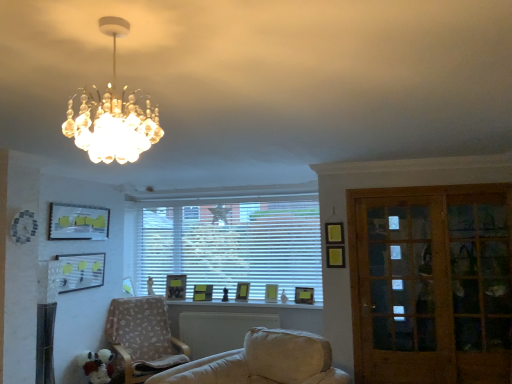
Question: Should I look upward or downward to see matte yellow picture frame at upper left, the first picture frame positioned from the left?

Choices:
 (A) down
 (B) up

Answer: (A)

Question: Can you confirm if matte black picture frame at window, which is the third picture frame in right-to-left order, is bigger than white glossy window sill at center?

Choices:
 (A) yes
 (B) no

Answer: (B)

Question: From the image's perspective, is matte black picture frame at window, the 5th picture frame from the left, located above white glossy window sill at center?

Choices:
 (A) no
 (B) yes

Answer: (B)

Question: Is matte black picture frame at window, which is the third picture frame in right-to-left order, at the left side of white glossy window sill at center?

Choices:
 (A) no
 (B) yes

Answer: (A)

Question: Is matte black picture frame at window, the 5th picture frame from the left, aimed at white glossy window sill at center?

Choices:
 (A) no
 (B) yes

Answer: (A)

Question: Is white glossy window sill at center a part of matte black picture frame at window, which is the third picture frame in right-to-left order?

Choices:
 (A) yes
 (B) no

Answer: (B)

Question: Is matte yellow picture frame at left, placed as the second picture frame when sorted from left to right, to the right of matte black picture frame at center, which is the 3th picture frame from left to right, from the viewer's perspective?

Choices:
 (A) yes
 (B) no

Answer: (B)

Question: Can you confirm if matte yellow picture frame at left, placed as the second picture frame when sorted from left to right, is thinner than matte black picture frame at center, marked as the 5th picture frame in a right-to-left arrangement?

Choices:
 (A) yes
 (B) no

Answer: (A)

Question: Can you confirm if matte yellow picture frame at left, positioned as the 6th picture frame in right-to-left order, is taller than matte black picture frame at center, marked as the 5th picture frame in a right-to-left arrangement?

Choices:
 (A) yes
 (B) no

Answer: (A)

Question: Is matte yellow picture frame at left, positioned as the 6th picture frame in right-to-left order, facing away from matte black picture frame at center, which is the 3th picture frame from left to right?

Choices:
 (A) no
 (B) yes

Answer: (A)

Question: Is matte yellow picture frame at left, placed as the second picture frame when sorted from left to right, to the left of matte black picture frame at center, which is the 3th picture frame from left to right, from the viewer's perspective?

Choices:
 (A) no
 (B) yes

Answer: (B)

Question: From a real-world perspective, is matte yellow picture frame at left, placed as the second picture frame when sorted from left to right, positioned over matte black picture frame at center, which is the 3th picture frame from left to right, based on gravity?

Choices:
 (A) no
 (B) yes

Answer: (B)

Question: Is matte black picture frame at center, which is the 4th picture frame from right to left, to the right of matte yellow picture frame at center, which is counted as the second picture frame, starting from the right, from the viewer's perspective?

Choices:
 (A) no
 (B) yes

Answer: (A)